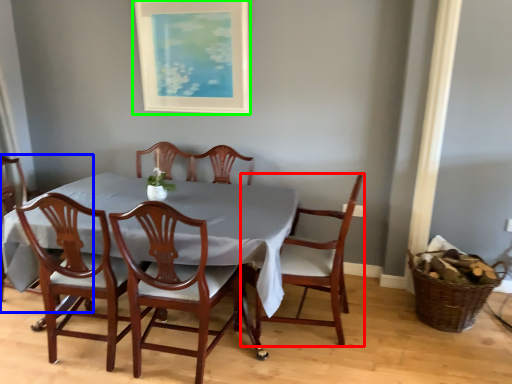
Question: Which object is the closest to the chair (highlighted by a red box)? Choose among these: chair (highlighted by a blue box) or picture frame (highlighted by a green box).

Choices:
 (A) chair
 (B) picture frame

Answer: (B)